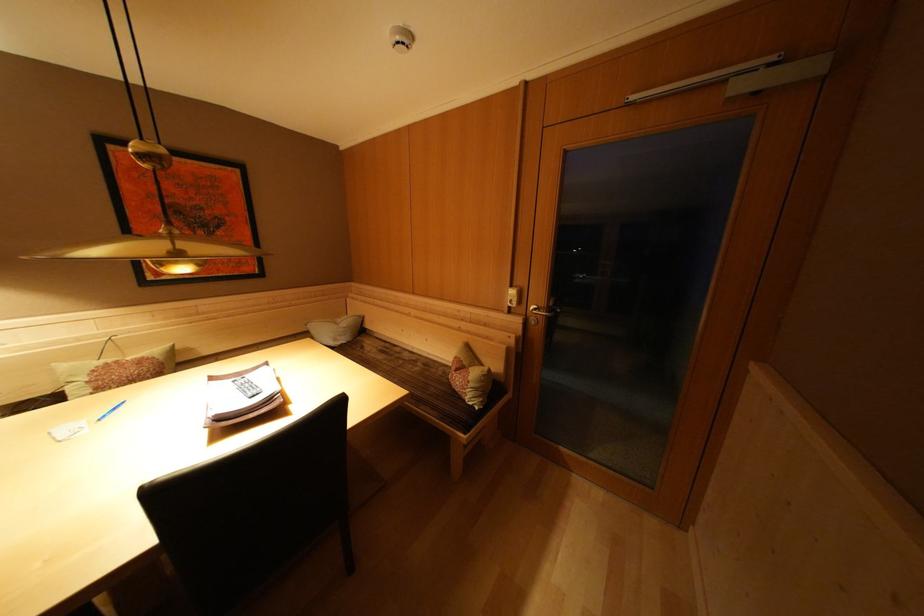
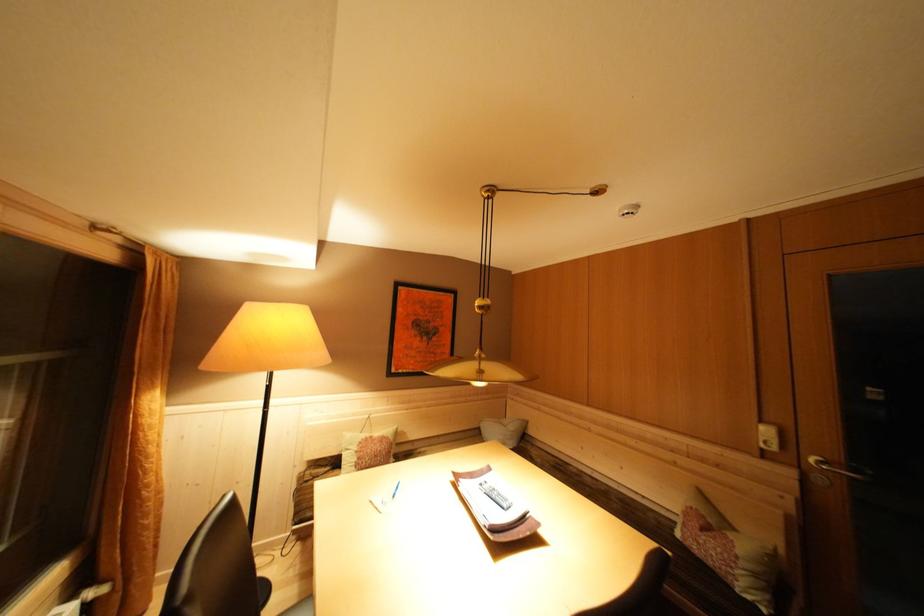
How did the camera likely rotate?

The rotation direction of the camera is left-up.